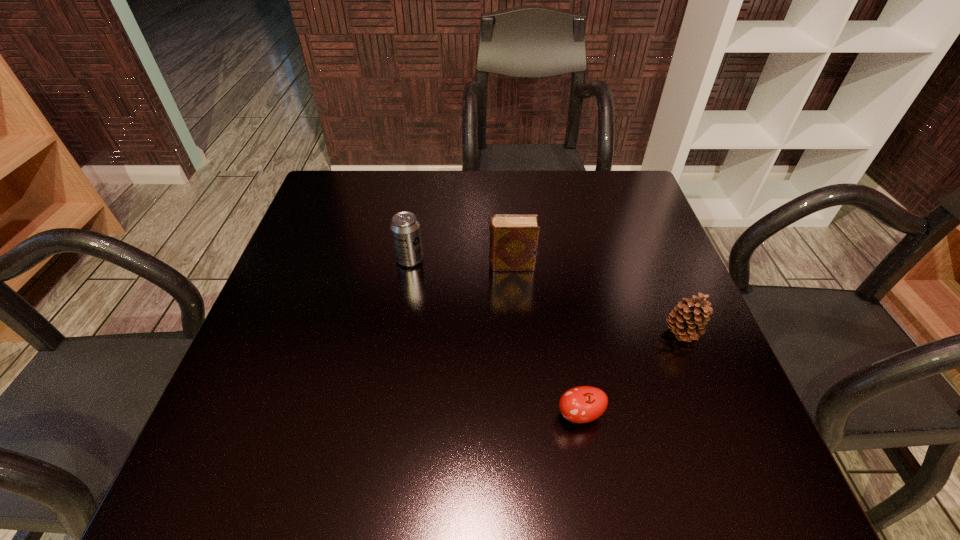
The width and height of the screenshot is (960, 540). Find the location of `vacant region between the beer can and the diary`. vacant region between the beer can and the diary is located at coordinates (461, 262).

Find the location of `free space between the shortest object and the leftmost object`. free space between the shortest object and the leftmost object is located at coordinates (494, 337).

Where is `free space between the diary and the nearest object`? This screenshot has width=960, height=540. free space between the diary and the nearest object is located at coordinates (545, 340).

Where is `unoccupied position between the pinecone and the beer can`? This screenshot has width=960, height=540. unoccupied position between the pinecone and the beer can is located at coordinates (545, 296).

Locate an element on the screen. free spot between the second object from left to right and the rightmost object is located at coordinates (596, 299).

The height and width of the screenshot is (540, 960). I want to click on vacant region between the second nearest object and the diary, so click(x=596, y=299).

Image resolution: width=960 pixels, height=540 pixels. In order to click on blank region between the nearest object and the pinecone in this screenshot , I will do `click(630, 374)`.

The image size is (960, 540). Find the location of `free space between the beer can and the second object from left to right`. free space between the beer can and the second object from left to right is located at coordinates (461, 262).

Where is `blank region between the pinecone and the second object from left to right`? blank region between the pinecone and the second object from left to right is located at coordinates (596, 299).

Locate an element on the screen. empty location between the rightmost object and the leftmost object is located at coordinates (545, 296).